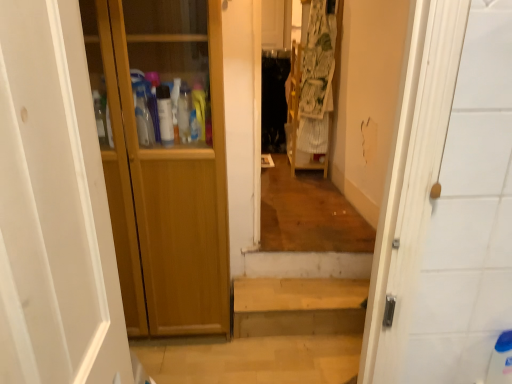
In order to click on free location in front of wooden cabinet at left in this screenshot , I will do `click(176, 360)`.